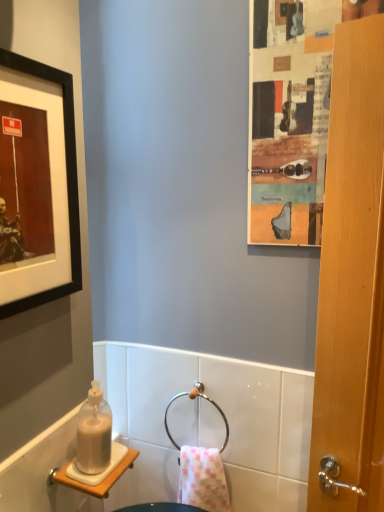
Question: Based on their positions, is wooden-framed collage at upper right located to the left or right of polished metal towel ring at center?

Choices:
 (A) left
 (B) right

Answer: (B)

Question: In terms of height, does wooden-framed collage at upper right look taller or shorter compared to polished metal towel ring at center?

Choices:
 (A) tall
 (B) short

Answer: (A)

Question: Estimate the real-world distances between objects in this image. Which object is farther from the translucent plastic bottle at lower left?

Choices:
 (A) polished metal towel ring at center
 (B) black matte picture frame at upper left
 (C) wooden-framed collage at upper right
 (D) pink checkered towel at center

Answer: (C)

Question: Which object is the closest to the polished metal towel ring at center?

Choices:
 (A) wooden-framed collage at upper right
 (B) pink checkered towel at center
 (C) black matte picture frame at upper left
 (D) translucent plastic bottle at lower left

Answer: (B)